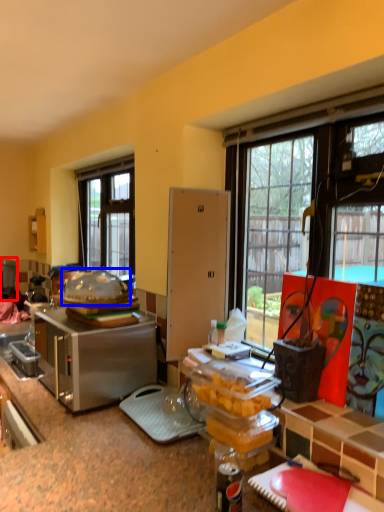
Question: Which of the following is the farthest to the observer, appliance (highlighted by a red box) or food (highlighted by a blue box)?

Choices:
 (A) appliance
 (B) food

Answer: (A)